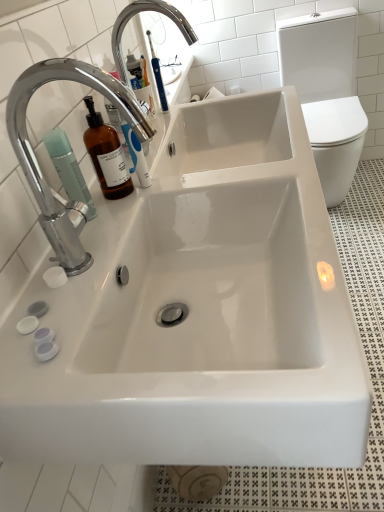
At what (x,y) coordinates should I click in order to perform the action: click on vacant space in front of matte green pump bottle at left. Please return your answer as a coordinate pair (x, y). The width and height of the screenshot is (384, 512). Looking at the image, I should click on (90, 258).